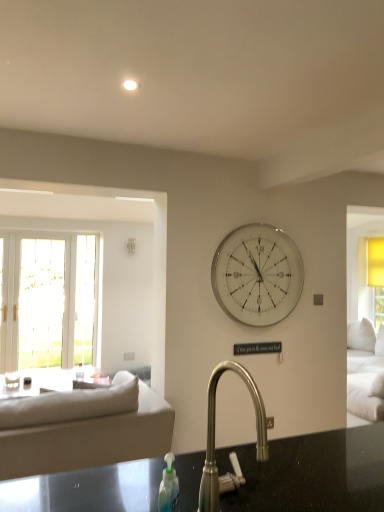
Question: Are satin nickel faucet at center and beige fabric couch at left located far from each other?

Choices:
 (A) yes
 (B) no

Answer: (A)

Question: From a real-world perspective, does satin nickel faucet at center sit lower than beige fabric couch at left?

Choices:
 (A) yes
 (B) no

Answer: (B)

Question: Can you confirm if satin nickel faucet at center is wider than beige fabric couch at left?

Choices:
 (A) yes
 (B) no

Answer: (B)

Question: Does satin nickel faucet at center have a lesser height compared to beige fabric couch at left?

Choices:
 (A) no
 (B) yes

Answer: (B)

Question: From a real-world perspective, is satin nickel faucet at center on beige fabric couch at left?

Choices:
 (A) no
 (B) yes

Answer: (B)

Question: Looking at the image, does white glass wall clock at center seem bigger or smaller compared to satin nickel faucet at center?

Choices:
 (A) small
 (B) big

Answer: (B)

Question: Is point (213, 270) positioned closer to the camera than point (213, 438)?

Choices:
 (A) closer
 (B) farther

Answer: (B)

Question: In terms of height, does white glass wall clock at center look taller or shorter compared to satin nickel faucet at center?

Choices:
 (A) tall
 (B) short

Answer: (A)

Question: Is white glass wall clock at center wider or thinner than satin nickel faucet at center?

Choices:
 (A) wide
 (B) thin

Answer: (B)

Question: From a real-world perspective, is satin nickel faucet at center positioned above or below beige fabric couch at left?

Choices:
 (A) below
 (B) above

Answer: (B)

Question: Based on their positions, is satin nickel faucet at center located to the left or right of beige fabric couch at left?

Choices:
 (A) right
 (B) left

Answer: (A)

Question: Considering their positions, is satin nickel faucet at center located in front of or behind beige fabric couch at left?

Choices:
 (A) behind
 (B) front

Answer: (B)

Question: Would you say satin nickel faucet at center is inside or outside beige fabric couch at left?

Choices:
 (A) outside
 (B) inside

Answer: (A)

Question: Looking at their shapes, would you say beige fabric couch at left is wider or thinner than white glass wall clock at center?

Choices:
 (A) wide
 (B) thin

Answer: (A)

Question: Is beige fabric couch at left to the left or to the right of white glass wall clock at center in the image?

Choices:
 (A) right
 (B) left

Answer: (B)